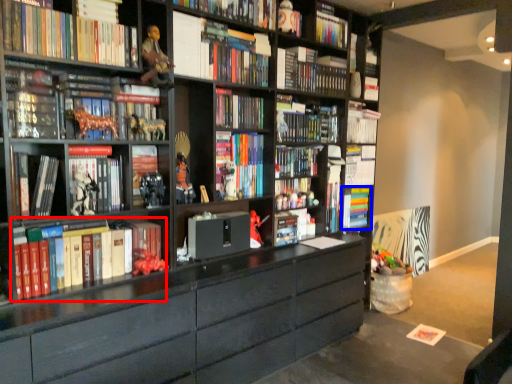
Question: Which point is further to the camera, book (highlighted by a red box) or book (highlighted by a blue box)?

Choices:
 (A) book
 (B) book

Answer: (B)